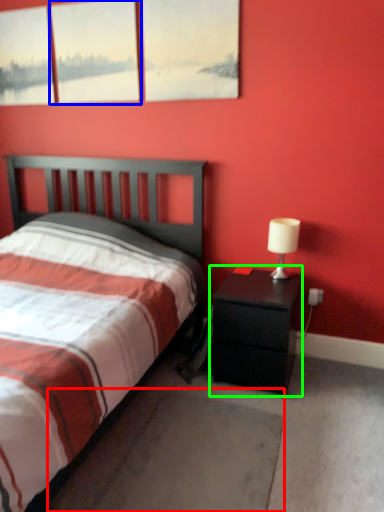
Question: Which object is the closest to the concrete (highlighted by a red box)? Choose among these: window (highlighted by a blue box) or nightstand (highlighted by a green box).

Choices:
 (A) window
 (B) nightstand

Answer: (B)